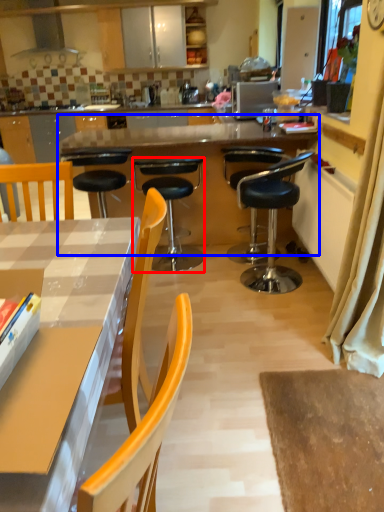
Question: Which of the following is the farthest to the observer, chair (highlighted by a red box) or round table (highlighted by a blue box)?

Choices:
 (A) chair
 (B) round table

Answer: (B)